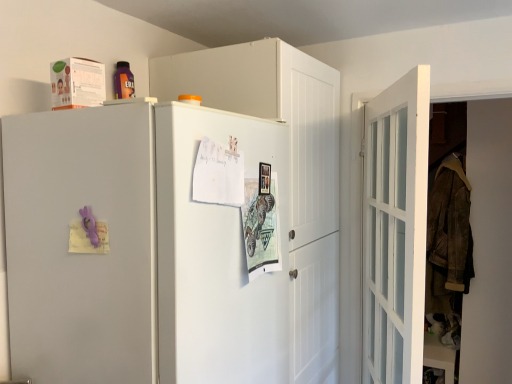
Question: From a real-world perspective, is white matte cabinet at upper center above or below white glossy door at right?

Choices:
 (A) above
 (B) below

Answer: (A)

Question: Considering the positions of point (197, 51) and point (374, 294), is point (197, 51) closer or farther from the camera than point (374, 294)?

Choices:
 (A) closer
 (B) farther

Answer: (A)

Question: Estimate the real-world distances between objects in this image. Which object is closer to the white matte refrigerator at upper left?

Choices:
 (A) white matte cabinet at upper center
 (B) white glossy door at right

Answer: (A)

Question: Estimate the real-world distances between objects in this image. Which object is farther from the white matte cabinet at upper center?

Choices:
 (A) white glossy door at right
 (B) white matte refrigerator at upper left

Answer: (A)